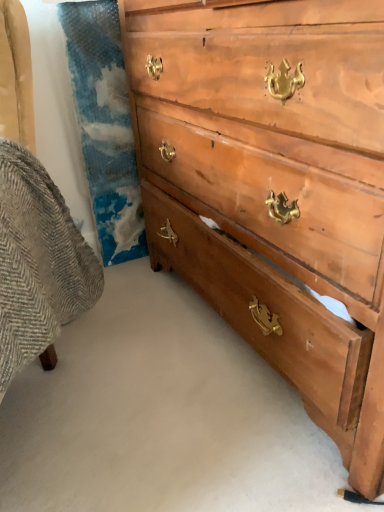
Describe the element at coordinates (273, 187) in the screenshot. This screenshot has height=512, width=384. I see `light brown wood chest of drawers at center` at that location.

Measure the distance between point [330,1] and camera.

The depth of point [330,1] is 21.69 inches.

Find the location of a particular element. The width and height of the screenshot is (384, 512). light brown wood chest of drawers at center is located at coordinates click(x=273, y=187).

This screenshot has width=384, height=512. Describe the element at coordinates (38, 264) in the screenshot. I see `textured gray fabric swivel chair at left` at that location.

In order to face textured gray fabric swivel chair at left, should I rotate leftwards or rightwards?

Turn left by 26.818 degrees to look at textured gray fabric swivel chair at left.

Locate an element on the screen. textured gray fabric swivel chair at left is located at coordinates (38, 264).

You are a GUI agent. You are given a task and a screenshot of the screen. Output one action in this format:
    pyautogui.click(x=<x>, y=<y>)
    Task: Click on the light brown wood chest of drawers at center
    This screenshot has height=512, width=384.
    Given the screenshot: What is the action you would take?
    pyautogui.click(x=273, y=187)

Considering the relative positions of textured gray fabric swivel chair at left and light brown wood chest of drawers at center in the image provided, is textured gray fabric swivel chair at left to the left of light brown wood chest of drawers at center from the viewer's perspective?

Correct, you'll find textured gray fabric swivel chair at left to the left of light brown wood chest of drawers at center.

Is textured gray fabric swivel chair at left closer to the viewer compared to light brown wood chest of drawers at center?

Yes, textured gray fabric swivel chair at left is closer to the viewer.

Is point (77, 302) positioned in front of point (215, 261)?

Yes, it is.

From the image's perspective, does textured gray fabric swivel chair at left appear higher than light brown wood chest of drawers at center?

No, from the image's perspective, textured gray fabric swivel chair at left is not over light brown wood chest of drawers at center.

From a real-world perspective, which object rests below the other?

textured gray fabric swivel chair at left, from a real-world perspective.

Looking at their sizes, would you say textured gray fabric swivel chair at left is wider or thinner than light brown wood chest of drawers at center?

textured gray fabric swivel chair at left is wider than light brown wood chest of drawers at center.

Considering the relative sizes of textured gray fabric swivel chair at left and light brown wood chest of drawers at center in the image provided, is textured gray fabric swivel chair at left taller than light brown wood chest of drawers at center?

Incorrect, the height of textured gray fabric swivel chair at left is not larger of that of light brown wood chest of drawers at center.

Between textured gray fabric swivel chair at left and light brown wood chest of drawers at center, which one has smaller size?

textured gray fabric swivel chair at left is smaller.

Does textured gray fabric swivel chair at left contain light brown wood chest of drawers at center?

Actually, light brown wood chest of drawers at center is outside textured gray fabric swivel chair at left.

Are textured gray fabric swivel chair at left and light brown wood chest of drawers at center making contact?

No, textured gray fabric swivel chair at left is not in contact with light brown wood chest of drawers at center.

Is textured gray fabric swivel chair at left positioned with its back to light brown wood chest of drawers at center?

No, textured gray fabric swivel chair at left's orientation is not away from light brown wood chest of drawers at center.

Can you tell me how much textured gray fabric swivel chair at left and light brown wood chest of drawers at center differ in facing direction?

62.1 degrees.

Find the location of a particular element. swivel chair on the left of light brown wood chest of drawers at center is located at coordinates (38, 264).

Considering the relative positions of light brown wood chest of drawers at center and textured gray fabric swivel chair at left in the image provided, is light brown wood chest of drawers at center to the left or to the right of textured gray fabric swivel chair at left?

Clearly, light brown wood chest of drawers at center is on the right of textured gray fabric swivel chair at left in the image.

Which object is closer to the camera taking this photo, light brown wood chest of drawers at center or textured gray fabric swivel chair at left?

textured gray fabric swivel chair at left is in front.

Which is behind, point (224, 3) or point (61, 208)?

Positioned behind is point (61, 208).

From the image's perspective, is light brown wood chest of drawers at center above or below textured gray fabric swivel chair at left?

light brown wood chest of drawers at center is situated higher than textured gray fabric swivel chair at left in the image.

From a real-world perspective, which is physically above, light brown wood chest of drawers at center or textured gray fabric swivel chair at left?

light brown wood chest of drawers at center, from a real-world perspective.

Between light brown wood chest of drawers at center and textured gray fabric swivel chair at left, which one has smaller width?

Thinner between the two is light brown wood chest of drawers at center.

From their relative heights in the image, would you say light brown wood chest of drawers at center is taller or shorter than textured gray fabric swivel chair at left?

Considering their sizes, light brown wood chest of drawers at center has more height than textured gray fabric swivel chair at left.

Does light brown wood chest of drawers at center have a larger size compared to textured gray fabric swivel chair at left?

Correct, light brown wood chest of drawers at center is larger in size than textured gray fabric swivel chair at left.

Is textured gray fabric swivel chair at left a part of light brown wood chest of drawers at center?

That's incorrect, textured gray fabric swivel chair at left is not inside light brown wood chest of drawers at center.

Is light brown wood chest of drawers at center far away from textured gray fabric swivel chair at left?

Actually, light brown wood chest of drawers at center and textured gray fabric swivel chair at left are a little close together.

Is light brown wood chest of drawers at center positioned with its back to textured gray fabric swivel chair at left?

No, textured gray fabric swivel chair at left is not at the back of light brown wood chest of drawers at center.

Can you tell me how much light brown wood chest of drawers at center and textured gray fabric swivel chair at left differ in facing direction?

The angle between the facing direction of light brown wood chest of drawers at center and the facing direction of textured gray fabric swivel chair at left is 62.1 degrees.

In order to click on swivel chair located below the light brown wood chest of drawers at center (from the image's perspective) in this screenshot , I will do `click(38, 264)`.

This screenshot has height=512, width=384. Identify the location of the chest of drawers lying behind the textured gray fabric swivel chair at left. (273, 187).

This screenshot has width=384, height=512. I want to click on swivel chair in front of the light brown wood chest of drawers at center, so click(x=38, y=264).